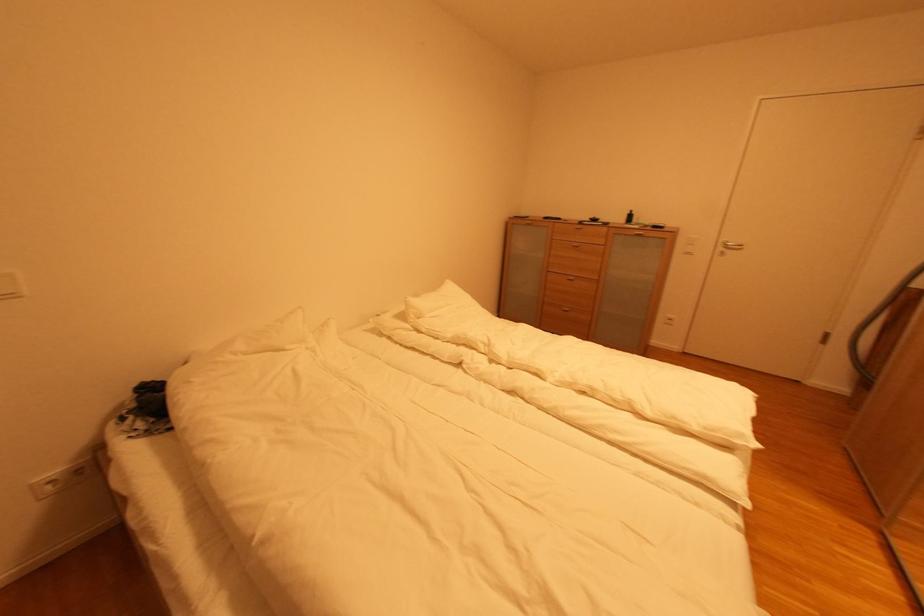
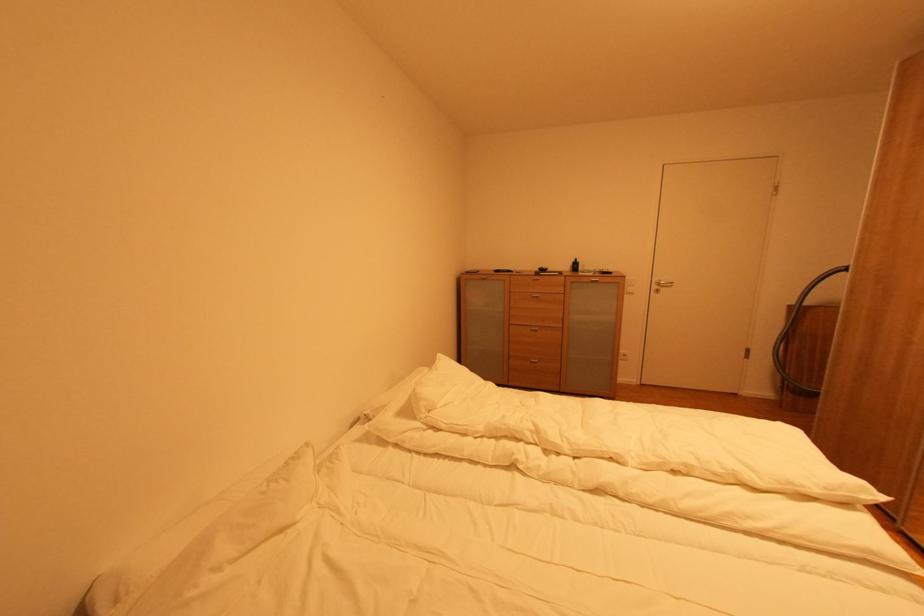
What movement of the cameraman would produce the second image?

The movement direction of the cameraman is left, forward.